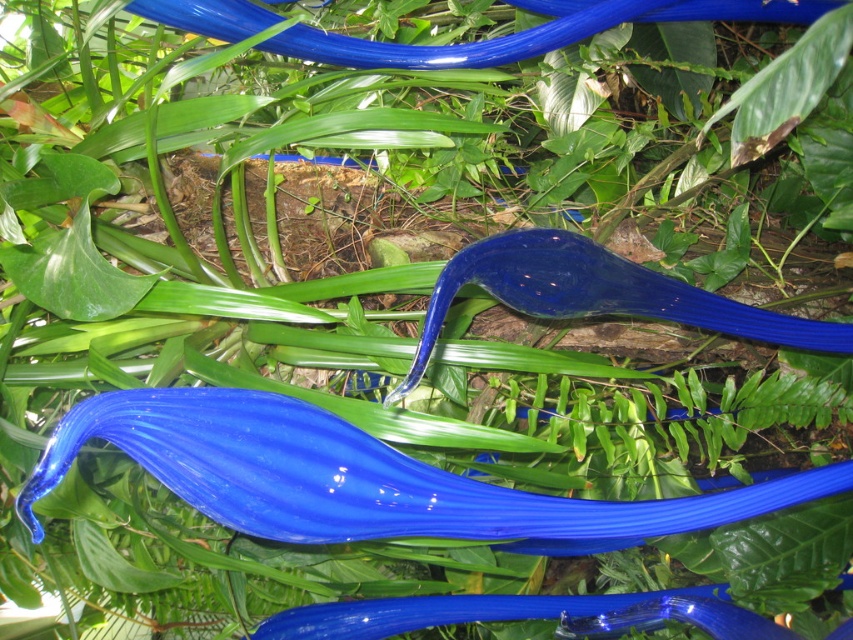
You are an artist planning to paint the scene. You need to decide the order of painting the glossy glass hose at center and the glossy blue hose at upper center to ensure proper layering. Which one should you paint first?

You should paint the glossy blue hose at upper center first because the glossy glass hose at center is positioned under it, so painting the upper one first allows the lower one to be placed beneath it in the layers.

Consider the image. You are an artist trying to create a sculpture arrangement similar to the one in the image. You have two hoses, the glossy glass hose at center and the glossy blue hose at upper center. Which hose should you place in a position where a thinner material is required for your design?

The glossy glass hose at center is thinner than the glossy blue hose at upper center, so you should use the glossy glass hose at center for the position requiring a thinner material.